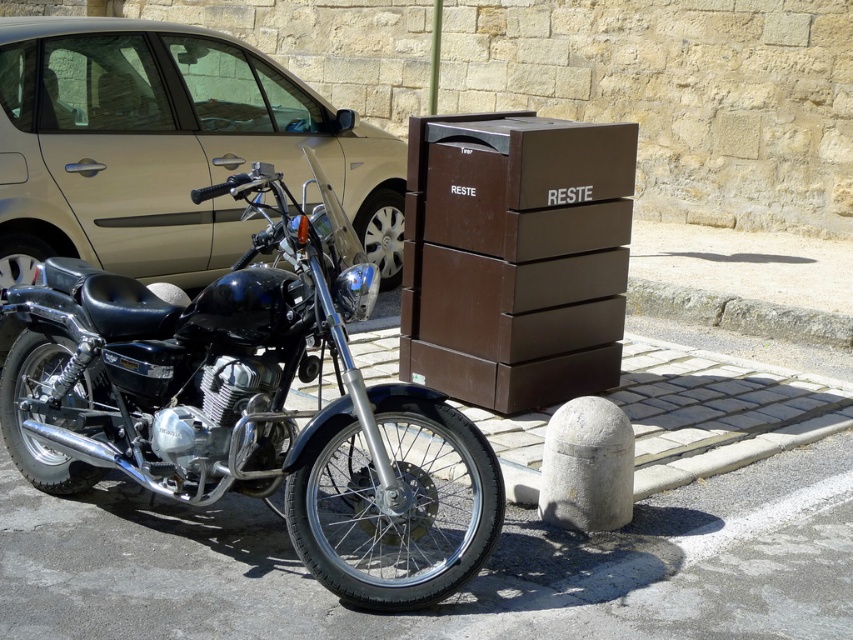
Question: Can you confirm if shiny black motorcycle at left is bigger than brown matte trash bin at center?

Choices:
 (A) yes
 (B) no

Answer: (A)

Question: Which of the following is the farthest from the observer?

Choices:
 (A) brown matte trash bin at center
 (B) shiny black motorcycle at left

Answer: (A)

Question: Among these points, which one is farthest from the camera?

Choices:
 (A) (399, 608)
 (B) (218, 208)
 (C) (567, 352)

Answer: (B)

Question: Can you confirm if shiny black motorcycle at left is thinner than metallic gold car at left?

Choices:
 (A) yes
 (B) no

Answer: (A)

Question: Is metallic gold car at left smaller than brown matte trash bin at center?

Choices:
 (A) no
 (B) yes

Answer: (A)

Question: Which of these objects is positioned closest to the metallic gold car at left?

Choices:
 (A) brown matte trash bin at center
 (B) shiny black motorcycle at left

Answer: (A)